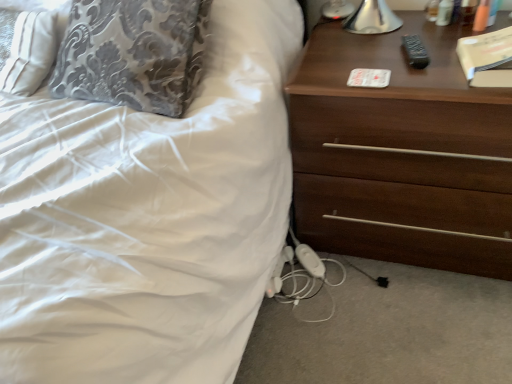
Where is `blank space to the left of beige matte book at upper right`? blank space to the left of beige matte book at upper right is located at coordinates (423, 77).